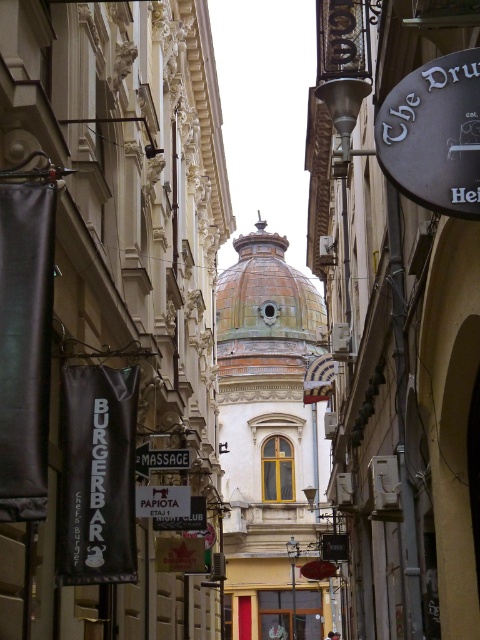
You are a tourist in a European city and you see the black rubber sign at upper right. Where exactly is it located in the scene?

The black rubber sign at upper right is located at point (434,134) in the scene.

From the picture: You are a delivery person trying to navigate through the narrow street. You see the black rubber sign at upper right and the brown tiled dome at center. Which object is closer to the ground?

The black rubber sign at upper right is closer to the ground because it is not as tall as the brown tiled dome at center.